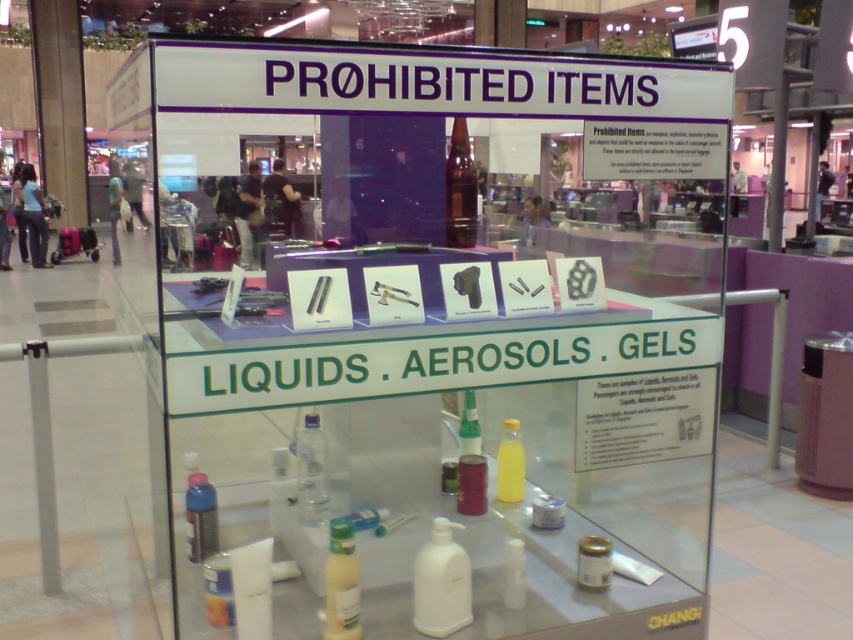
You are a traveler at Changi Airport and you see the prohibited items display. You want to know which of the two bottles, the translucent plastic bottle at center or the transparent glass bottle at center, is positioned to the left side of the other. Which one is on the left?

The translucent plastic bottle at center is positioned to the left of transparent glass bottle at center.